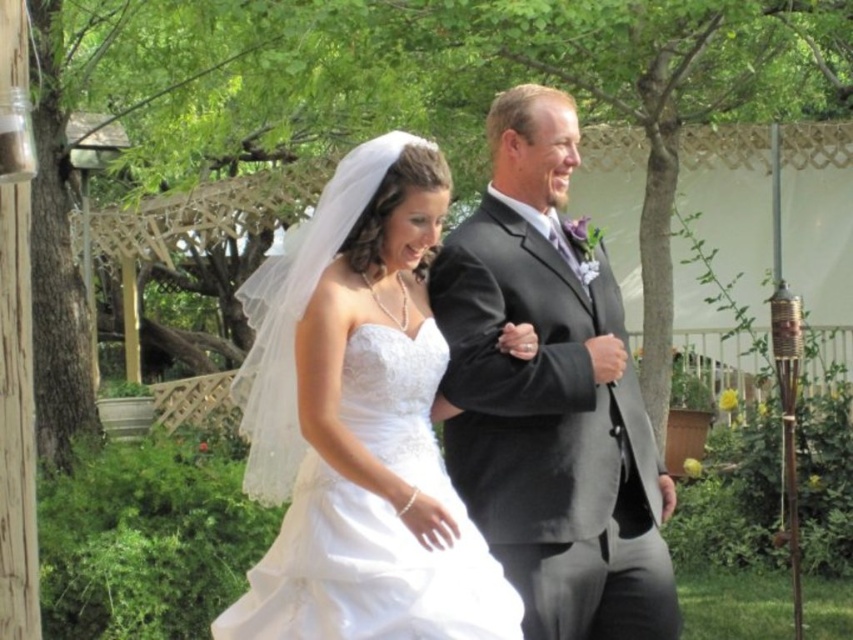
Does white satin dress at center lie in front of matte black suit at center?

Yes, it is in front of matte black suit at center.

What do you see at coordinates (358, 422) in the screenshot?
I see `white satin dress at center` at bounding box center [358, 422].

Where is `white satin dress at center`? white satin dress at center is located at coordinates (358, 422).